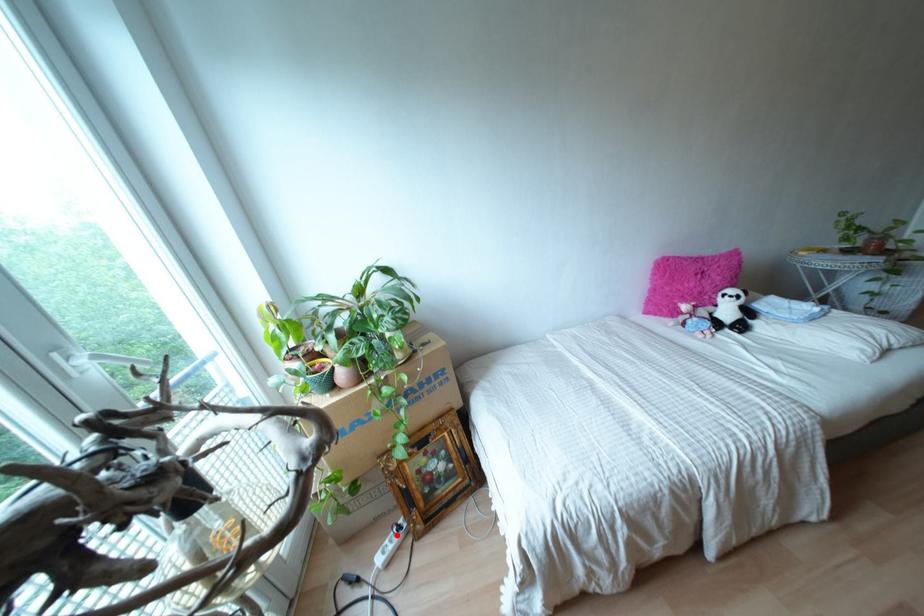
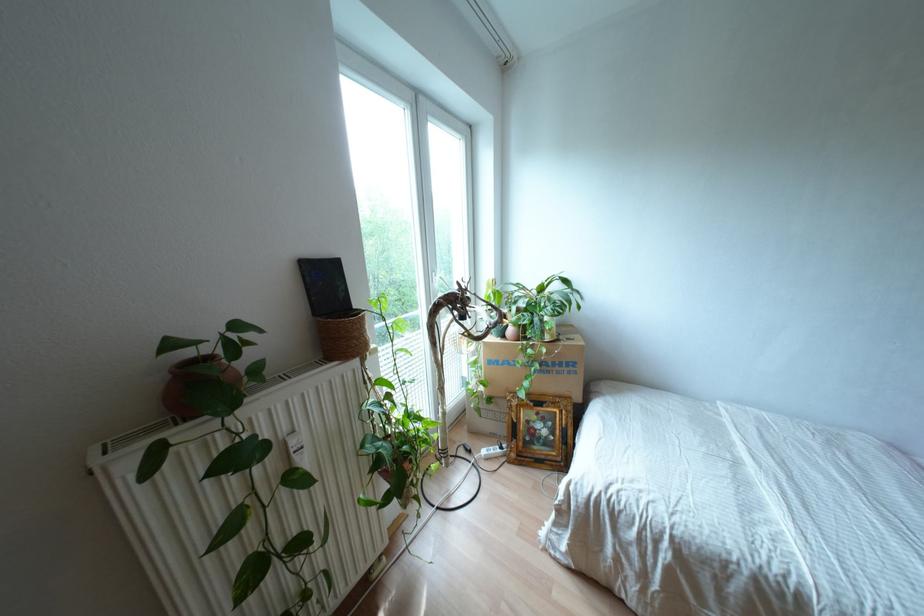
The point at the highlighted location is marked in the first image. Where is the corresponding point in the second image?

(497, 450)